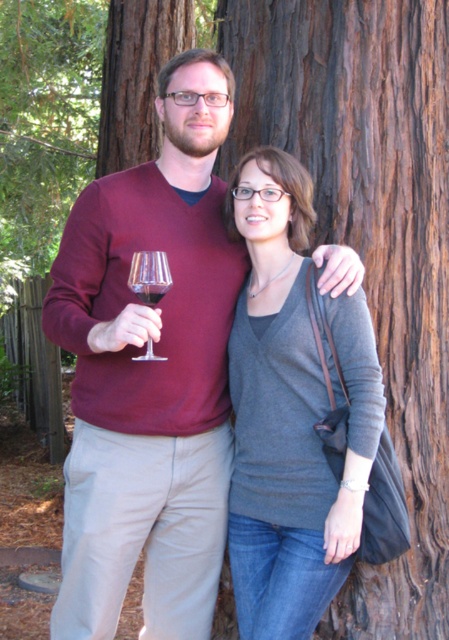
Question: Which of these objects is positioned closest to the maroon sweater at center?

Choices:
 (A) matte gray sweater at center
 (B) transparent glass at left
 (C) translucent glass at center

Answer: (A)

Question: Is maroon sweater at center above matte gray sweater at center?

Choices:
 (A) no
 (B) yes

Answer: (B)

Question: Is the position of matte gray sweater at center less distant than that of translucent glass at center?

Choices:
 (A) yes
 (B) no

Answer: (B)

Question: Based on their relative distances, which object is nearer to the maroon sweater at center?

Choices:
 (A) transparent glass at left
 (B) translucent glass at center
 (C) matte gray sweater at center

Answer: (C)

Question: Can you confirm if matte gray sweater at center is thinner than translucent glass at center?

Choices:
 (A) yes
 (B) no

Answer: (B)

Question: Which point is closer to the camera?

Choices:
 (A) maroon sweater at center
 (B) transparent glass at left
 (C) translucent glass at center
 (D) matte gray sweater at center

Answer: (A)